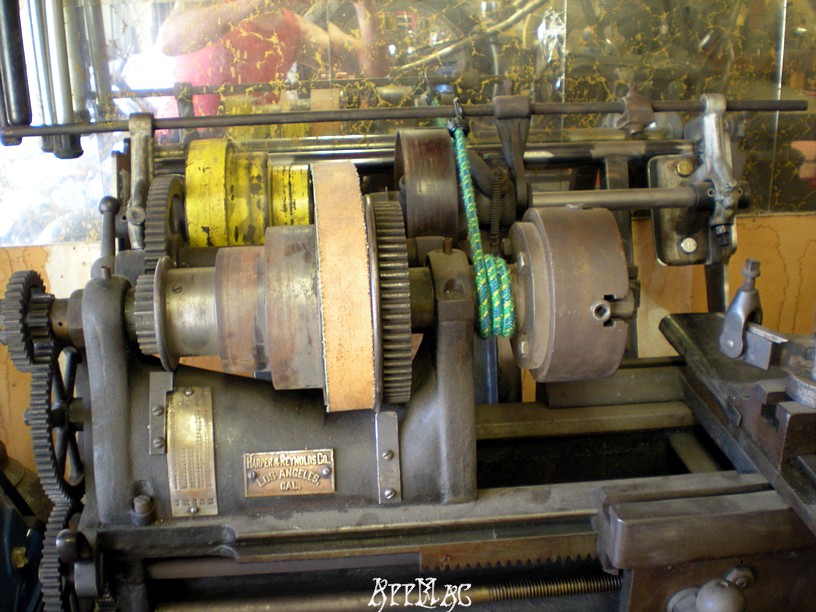
The image size is (816, 612). I want to click on plaques, so click(x=282, y=472), click(x=187, y=468).